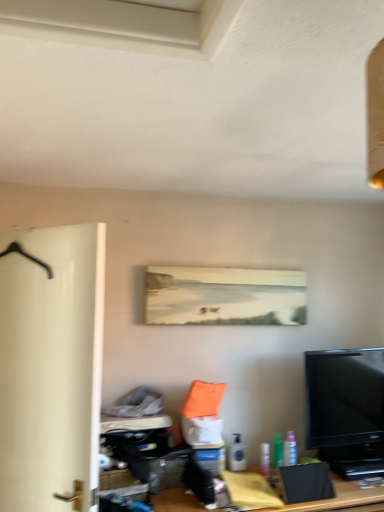
Where is `free space between translucent plastic spray can at lower center, the third toiletry when ordered from right to left, and green plastic bottle at lower right, acting as the second toiletry starting from the left`? Image resolution: width=384 pixels, height=512 pixels. free space between translucent plastic spray can at lower center, the third toiletry when ordered from right to left, and green plastic bottle at lower right, acting as the second toiletry starting from the left is located at coordinates (253, 470).